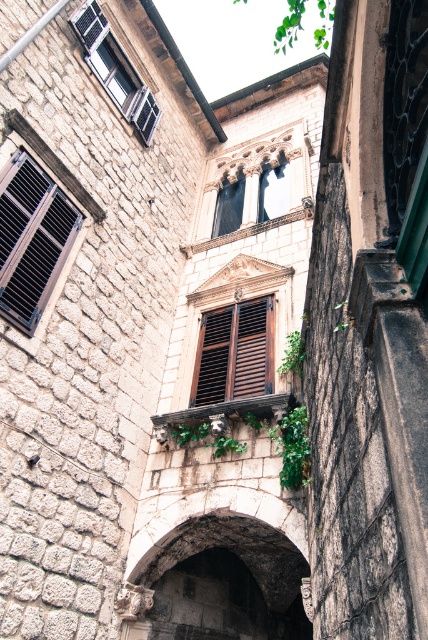
Question: Can you confirm if brown wooden shutters at center is thinner than green leafy ivy at upper center?

Choices:
 (A) yes
 (B) no

Answer: (A)

Question: Based on their relative distances, which object is farther from the matte black shutters at left?

Choices:
 (A) green leafy ivy at upper center
 (B) dark stone archway at center

Answer: (A)

Question: Is matte black shutters at left behind brown wooden shutters at center?

Choices:
 (A) no
 (B) yes

Answer: (A)

Question: Based on their relative distances, which object is farther from the green leafy ivy at upper center?

Choices:
 (A) matte black shutters at upper left
 (B) matte black shutters at left
 (C) brown wooden shutters at center

Answer: (B)

Question: Which of these objects is positioned farthest from the matte black shutters at left?

Choices:
 (A) brown wooden shutters at center
 (B) green leafy ivy at upper center
 (C) dark stone archway at center

Answer: (B)

Question: From the image, what is the correct spatial relationship of dark stone archway at center in relation to green leafy ivy at upper center?

Choices:
 (A) below
 (B) above

Answer: (A)